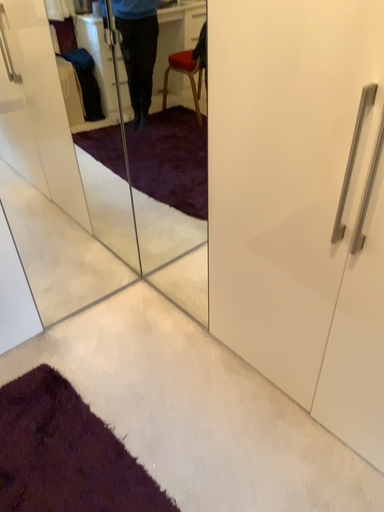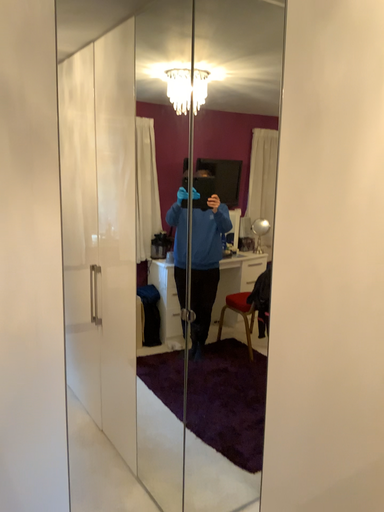
Question: Which way did the camera rotate in the video?

Choices:
 (A) rotated upward
 (B) rotated downward

Answer: (A)